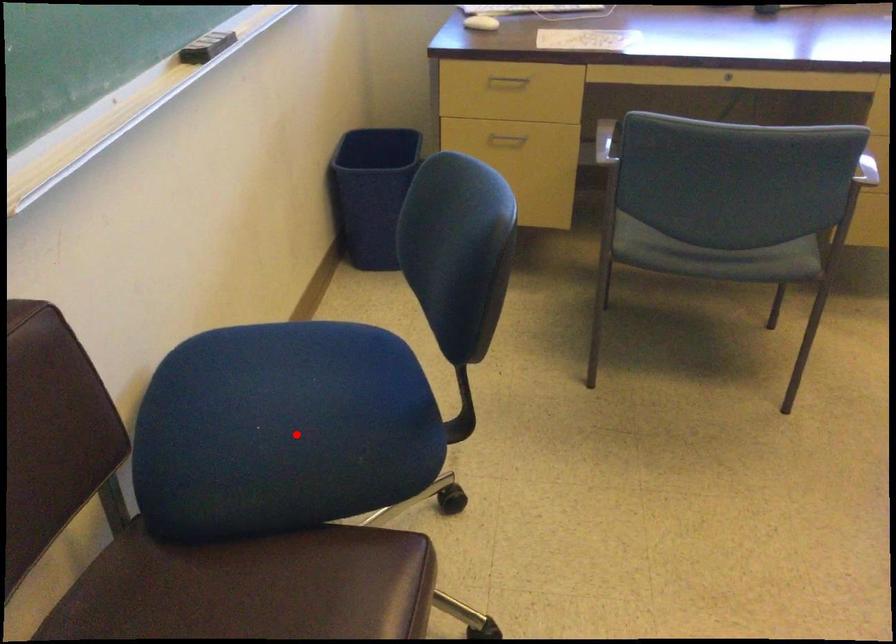
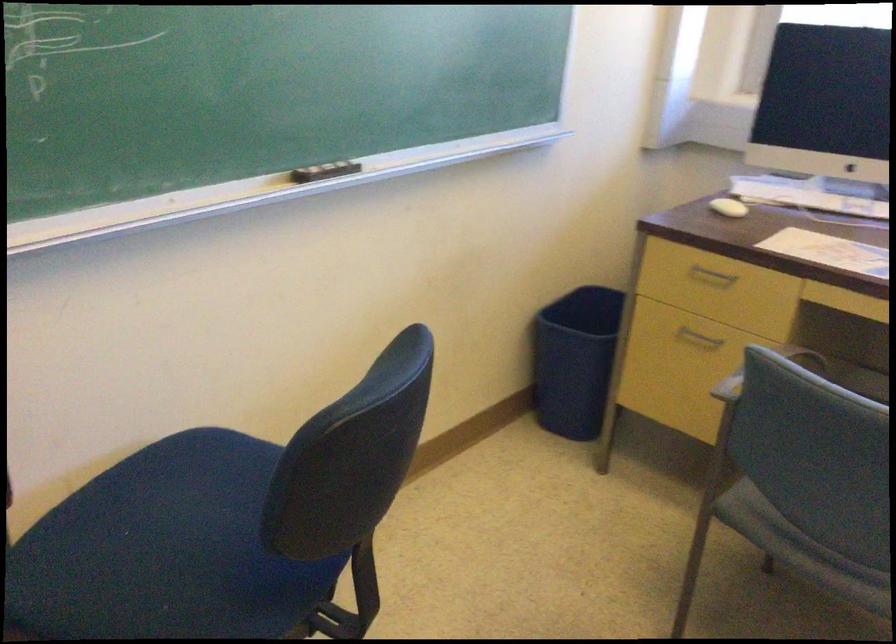
The point at the highlighted location is marked in the first image. Where is the corresponding point in the second image?

(165, 550)